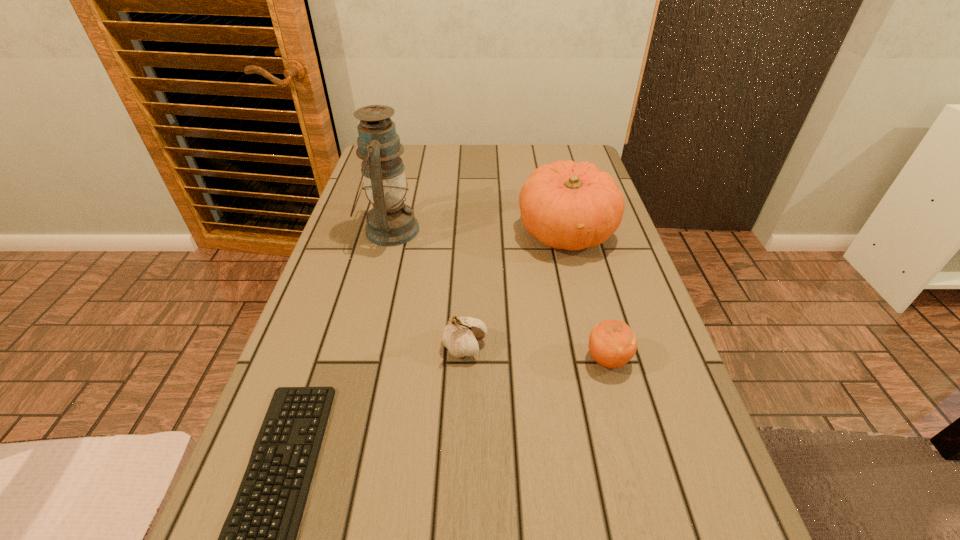
At what (x,y) coordinates should I click in order to perform the action: click on vacant point located between the third object from left to right and the orange. Please return your answer as a coordinate pair (x, y). The image size is (960, 540). Looking at the image, I should click on (537, 353).

I want to click on unoccupied area between the orange and the oil lamp, so click(x=498, y=295).

At what (x,y) coordinates should I click in order to perform the action: click on free space between the third object from right to left and the orange. Please return your answer as a coordinate pair (x, y). The height and width of the screenshot is (540, 960). Looking at the image, I should click on (537, 353).

Find the location of `vacant space that is in between the orange and the third object from right to left`. vacant space that is in between the orange and the third object from right to left is located at coordinates (537, 353).

Locate which object ranks third in proximity to the orange. Please provide its 2D coordinates. Your answer should be formatted as a tuple, i.e. [(x, y)], where the tuple contains the x and y coordinates of a point satisfying the conditions above.

[(390, 222)]

I want to click on object that is the fourth closest to the orange, so click(x=258, y=539).

The height and width of the screenshot is (540, 960). What are the coordinates of `vacant position in the image that satisfies the following two spatial constraints: 1. on the front side of the second tallest object; 2. on the right side of the oil lamp` in the screenshot? It's located at click(389, 232).

At what (x,y) coordinates should I click in order to perform the action: click on free space that satisfies the following two spatial constraints: 1. on the front side of the pumpkin; 2. on the left side of the orange. Please return your answer as a coordinate pair (x, y). Looking at the image, I should click on (597, 360).

Locate an element on the screen. vacant space that satisfies the following two spatial constraints: 1. on the front side of the third object from right to left; 2. on the right side of the orange is located at coordinates (465, 360).